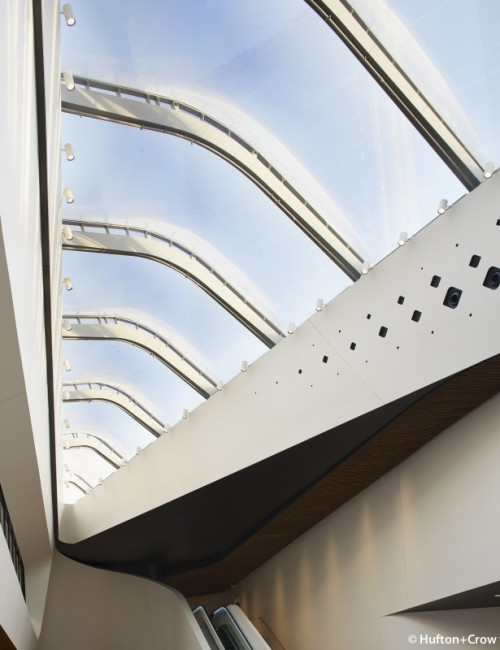
What are the coordinates of `brown wood paneling` in the screenshot? It's located at (349, 474).